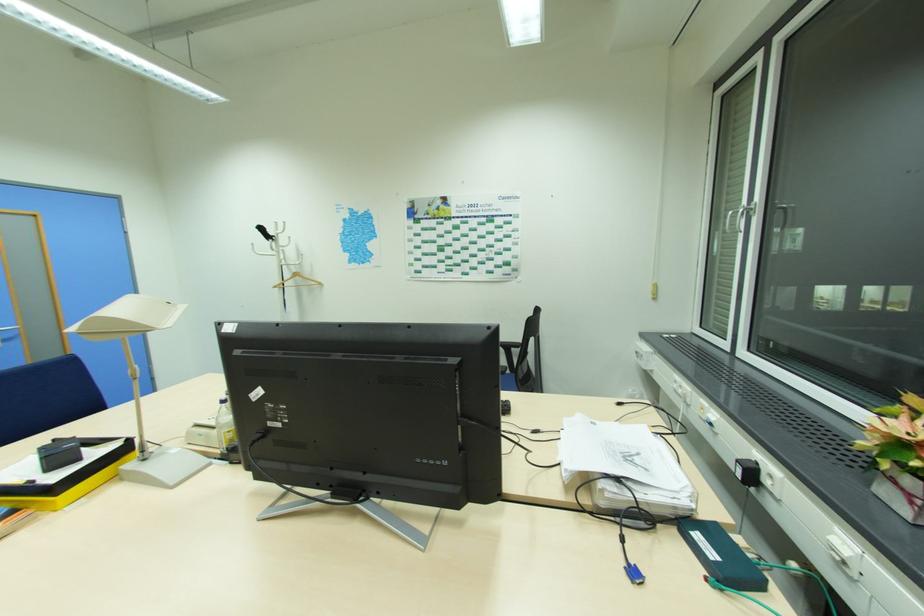
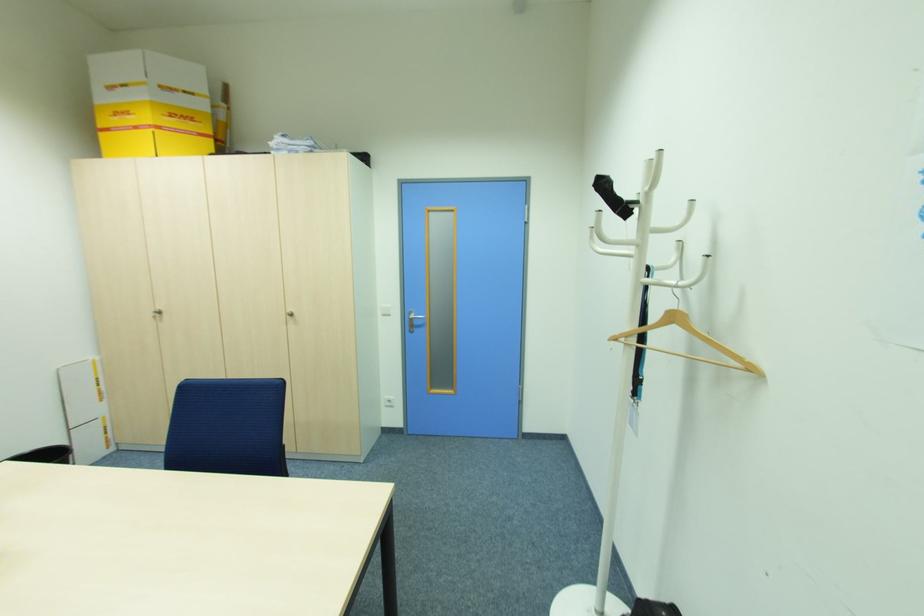
Locate, in the second image, the point that corresponds to (322,284) in the first image.

(756, 370)